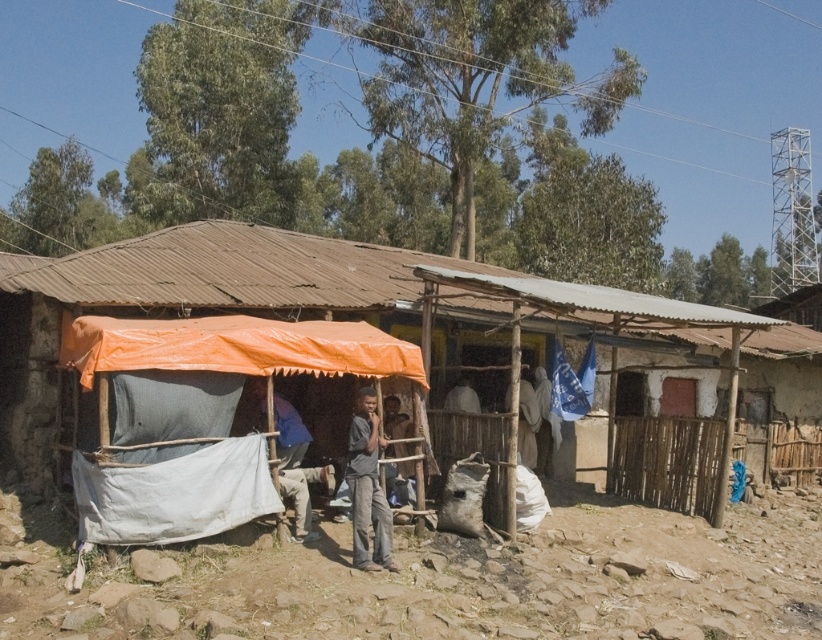
Question: Which object is farther from the camera taking this photo?

Choices:
 (A) gray matte shirt at center
 (B) dark gray fabric at center
 (C) light brown wooden pole at center
 (D) orange fabric tent at center

Answer: (C)

Question: Does light brown wooden pole at center have a larger size compared to white fabric at center?

Choices:
 (A) no
 (B) yes

Answer: (B)

Question: Which point is closer to the camera?

Choices:
 (A) light brown wooden pole at center
 (B) white fabric at center

Answer: (A)

Question: Is light brown wooden pole at center smaller than white fabric at center?

Choices:
 (A) yes
 (B) no

Answer: (B)

Question: Does dark brown fabric at center have a smaller size compared to white fabric at center?

Choices:
 (A) no
 (B) yes

Answer: (B)

Question: Among these points, which one is nearest to the camera?

Choices:
 (A) (543, 417)
 (B) (372, 481)

Answer: (B)